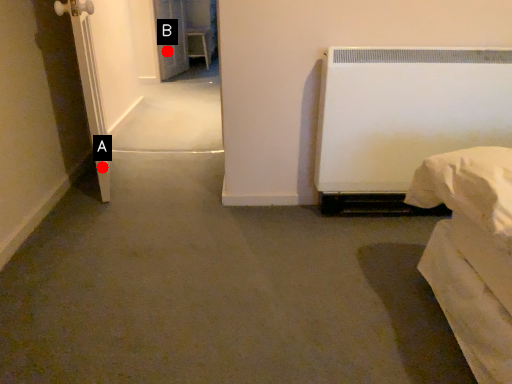
Question: Two points are circled on the image, labeled by A and B beside each circle. Which point appears closest to the camera in this image?

Choices:
 (A) A is closer
 (B) B is closer

Answer: (A)